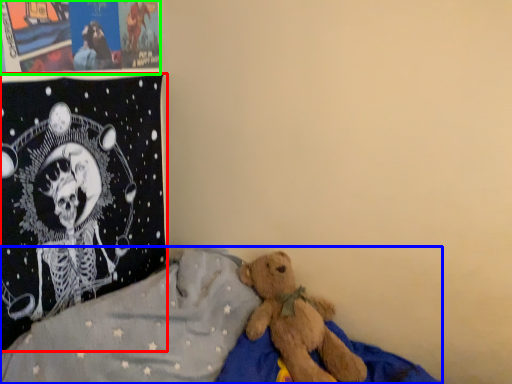
Question: Estimate the real-world distances between objects in this image. Which object is closer to pillow (highlighted by a red box), bed (highlighted by a blue box) or poster page (highlighted by a green box)?

Choices:
 (A) bed
 (B) poster page

Answer: (B)